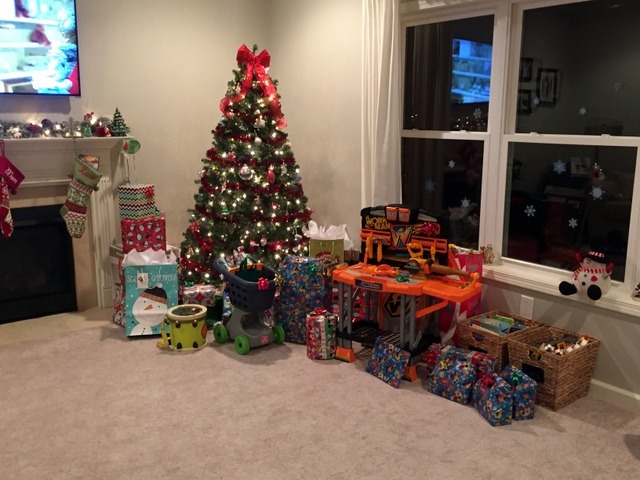
Locate an element on the screen. gift bags is located at coordinates (145, 290), (329, 241).